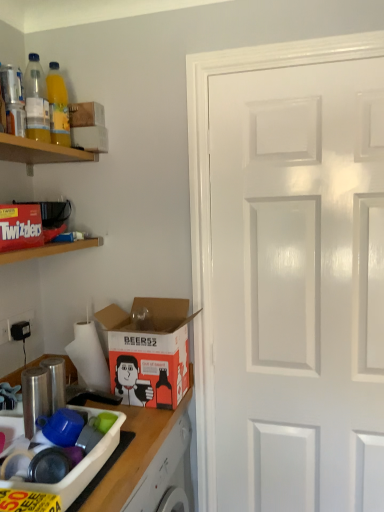
You are a GUI agent. You are given a task and a screenshot of the screen. Output one action in this format:
    pyautogui.click(x=<x>, y=<y>)
    Task: Click on the free spot above white glossy door at right (from a real-world perspective)
    This screenshot has height=512, width=384.
    Given the screenshot: What is the action you would take?
    pyautogui.click(x=309, y=60)